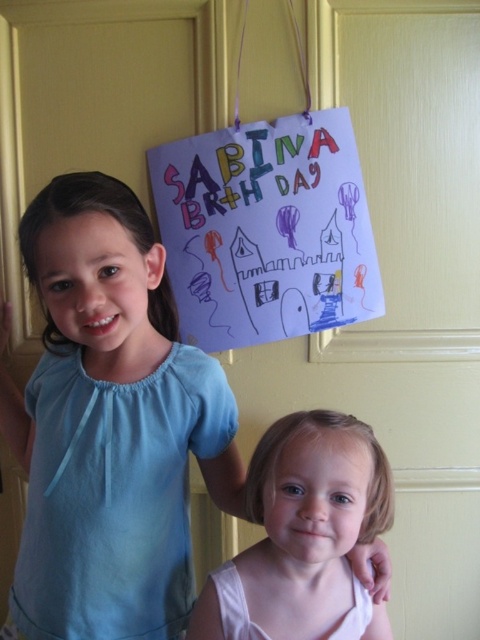
You are a photographer taking a picture of the two children standing against the pale yellow door. The purple paper sign at upper center is currently blocking your view. To avoid the sign, which direction should you move your camera? Please choose from the options below. The options are left, right, up, down, or any combination of these directions separated by commas. The answer must be in lowercase letters. The answer should not contain any other words or explanations.

down, left